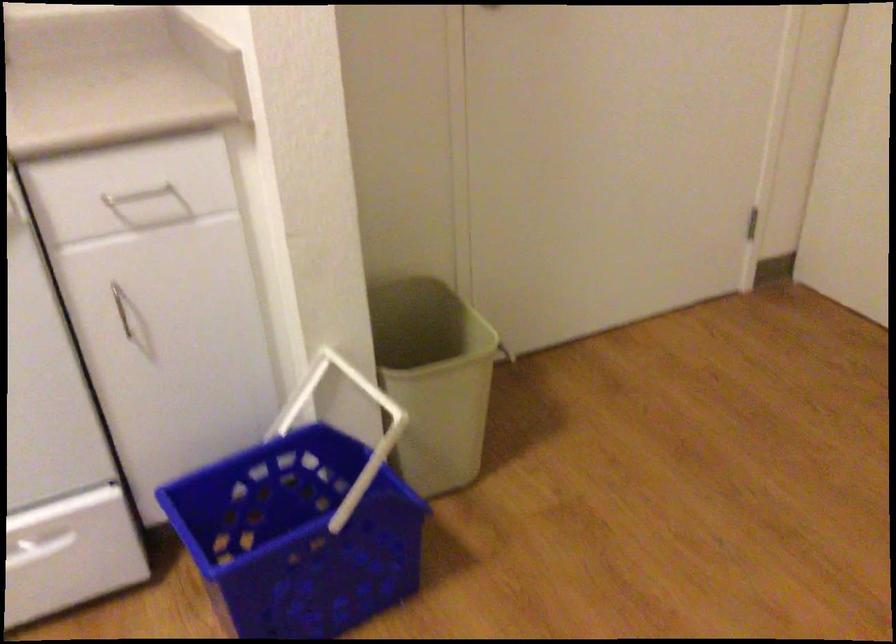
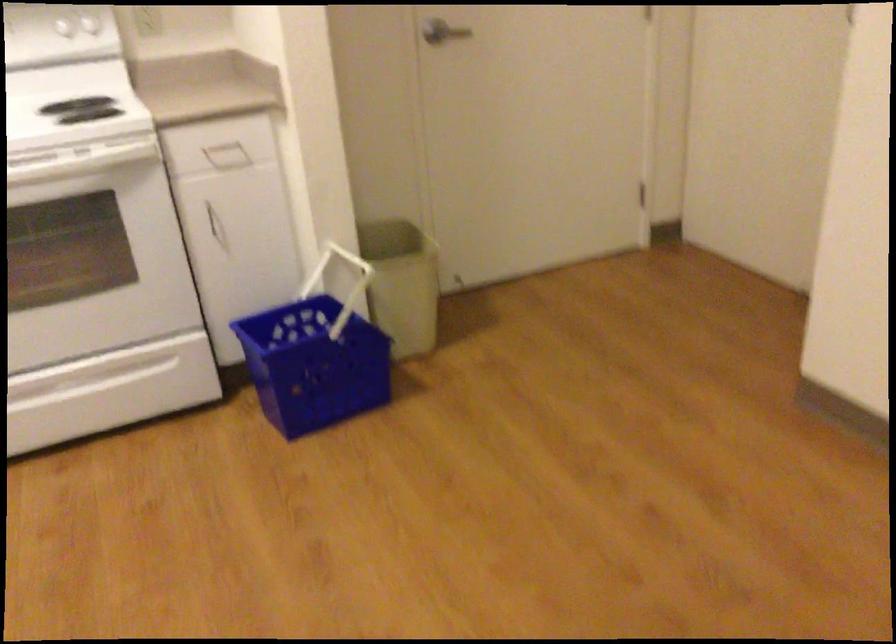
The point at (135,324) is marked in the first image. Where is the corresponding point in the second image?

(216, 225)